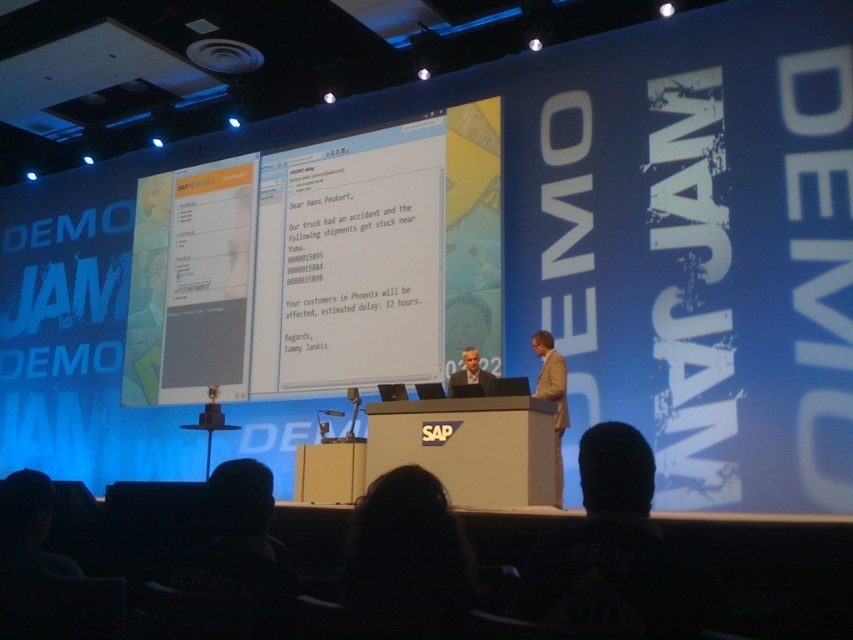
Question: Among these objects, which one is farthest from the camera?

Choices:
 (A) light brown suit at center
 (B) tan fabric suit at center

Answer: (A)

Question: Observing the image, what is the correct spatial positioning of tan fabric suit at center in reference to light brown suit at center?

Choices:
 (A) left
 (B) right

Answer: (B)

Question: Does tan fabric suit at center appear on the left side of light brown suit at center?

Choices:
 (A) no
 (B) yes

Answer: (A)

Question: Which point is farther from the camera taking this photo?

Choices:
 (A) (460, 378)
 (B) (560, 410)

Answer: (A)

Question: Does tan fabric suit at center have a smaller size compared to light brown suit at center?

Choices:
 (A) no
 (B) yes

Answer: (A)